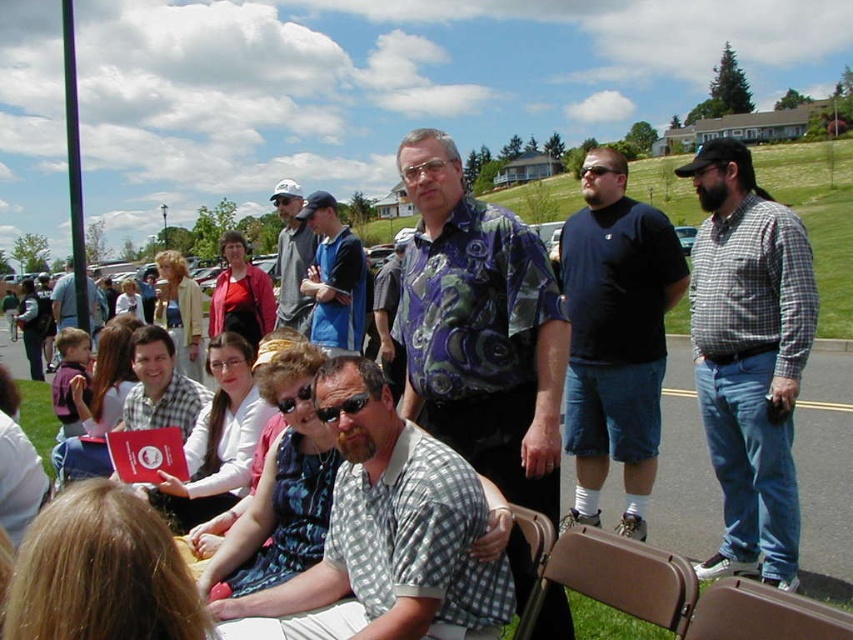
You are attending an outdoor event and see a checkered fabric shirt at right and a brown fabric chair at lower center. Which object is located higher in the image?

The checkered fabric shirt at right is positioned over the brown fabric chair at lower center, so it is higher in the image.

Looking at this image, you are standing at the edge of the park and see the tan fabric chair at lower center and the blue cotton shirt at center. Which object is closer to you?

The tan fabric chair at lower center is closer to you because it is in front of the blue cotton shirt at center.